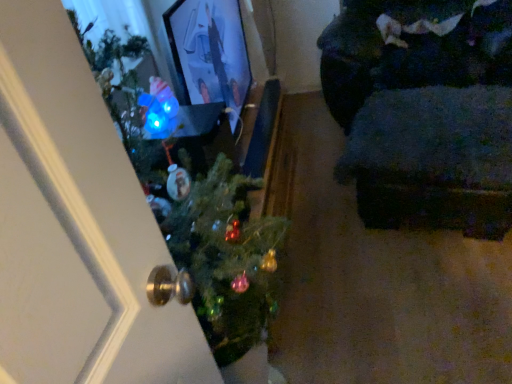
Question: Is green matte christmas tree at center taller than dark fabric couch at right?

Choices:
 (A) yes
 (B) no

Answer: (A)

Question: Considering the relative positions of green matte christmas tree at center and dark fabric couch at right in the image provided, is green matte christmas tree at center to the right of dark fabric couch at right from the viewer's perspective?

Choices:
 (A) yes
 (B) no

Answer: (B)

Question: Can you confirm if green matte christmas tree at center is smaller than dark fabric couch at right?

Choices:
 (A) no
 (B) yes

Answer: (B)

Question: Considering the relative positions of green matte christmas tree at center and dark fabric couch at right in the image provided, is green matte christmas tree at center behind dark fabric couch at right?

Choices:
 (A) no
 (B) yes

Answer: (A)

Question: From the image's perspective, is green matte christmas tree at center over dark fabric couch at right?

Choices:
 (A) no
 (B) yes

Answer: (A)

Question: Is green matte christmas tree at center oriented away from dark fabric couch at right?

Choices:
 (A) no
 (B) yes

Answer: (A)

Question: From a real-world perspective, is dark fabric couch at right beneath green matte christmas tree at center?

Choices:
 (A) no
 (B) yes

Answer: (B)

Question: Is dark fabric couch at right far from green matte christmas tree at center?

Choices:
 (A) yes
 (B) no

Answer: (A)

Question: Considering the relative positions of dark fabric couch at right and green matte christmas tree at center in the image provided, is dark fabric couch at right to the left of green matte christmas tree at center from the viewer's perspective?

Choices:
 (A) no
 (B) yes

Answer: (A)

Question: Is dark fabric couch at right taller than green matte christmas tree at center?

Choices:
 (A) yes
 (B) no

Answer: (B)

Question: From the image's perspective, is dark fabric couch at right located above green matte christmas tree at center?

Choices:
 (A) yes
 (B) no

Answer: (A)

Question: Can green matte christmas tree at center be found inside dark fabric couch at right?

Choices:
 (A) no
 (B) yes

Answer: (A)

Question: From a real-world perspective, is dark fabric couch at right above or below green matte christmas tree at center?

Choices:
 (A) below
 (B) above

Answer: (A)